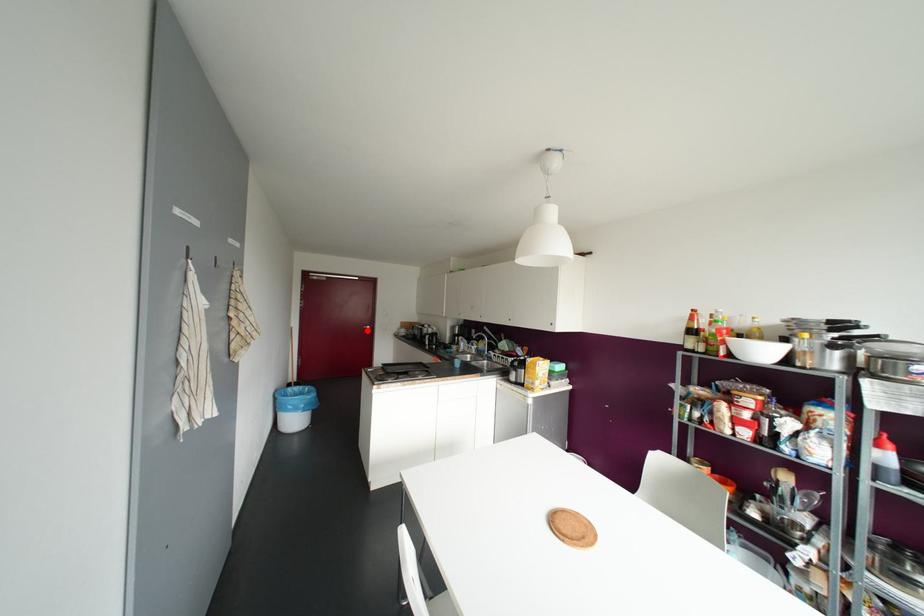
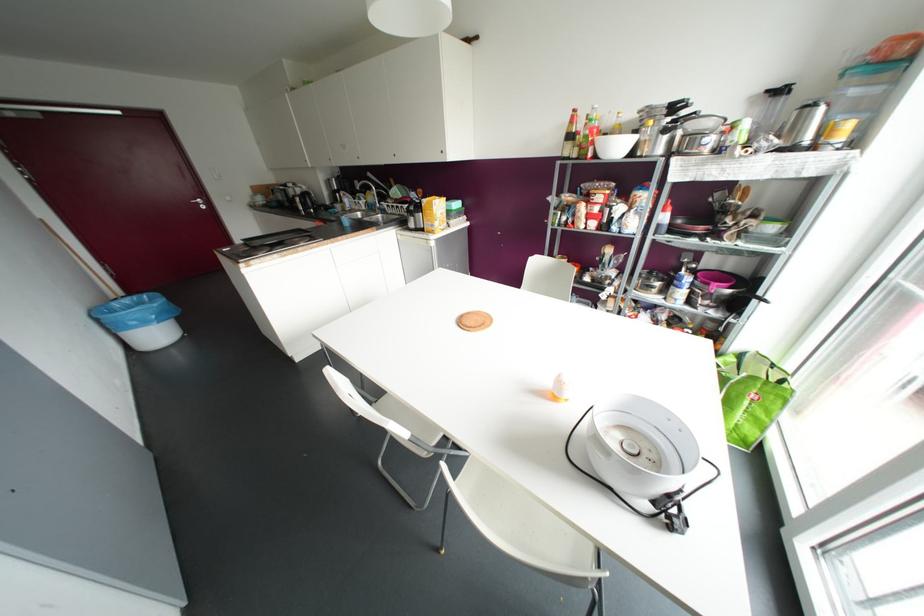
Find the pixel in the second image that matches the highlighted location in the first image.

(202, 207)